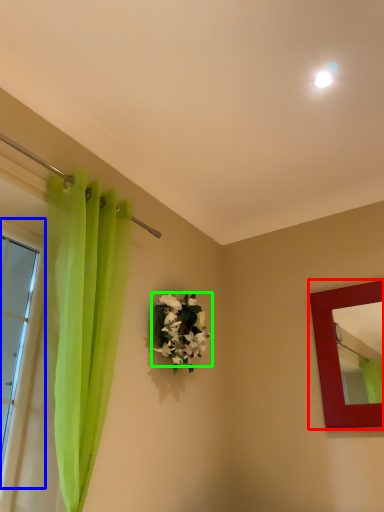
Question: Which object is positioned farthest from picture frame (highlighted by a red box)? Select from window (highlighted by a blue box) and flower (highlighted by a green box).

Choices:
 (A) window
 (B) flower

Answer: (A)